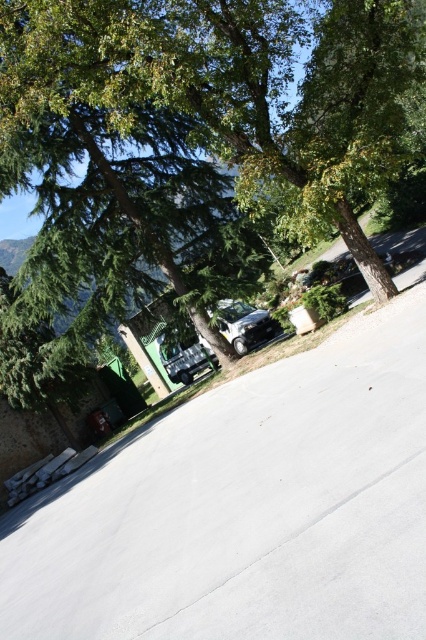
Can you confirm if green leafy tree at upper left is positioned above satin silver car at center?

Correct, green leafy tree at upper left is located above satin silver car at center.

Can you confirm if green leafy tree at upper left is positioned to the right of satin silver car at center?

No, green leafy tree at upper left is not to the right of satin silver car at center.

Is point (181, 112) behind point (236, 310)?

No, it is not.

Image resolution: width=426 pixels, height=640 pixels. In order to click on green leafy tree at upper left in this screenshot , I will do `click(195, 125)`.